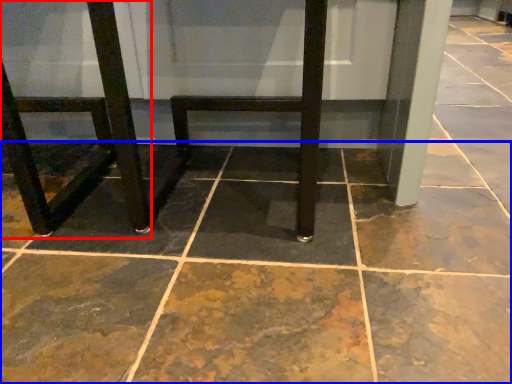
Question: Among these objects, which one is farthest to the camera, chair (highlighted by a red box) or concrete (highlighted by a blue box)?

Choices:
 (A) chair
 (B) concrete

Answer: (A)